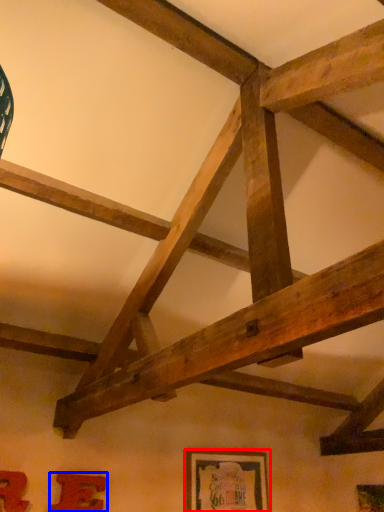
Question: Which of the following is the farthest to the observer, picture frame (highlighted by a red box) or picture frame (highlighted by a blue box)?

Choices:
 (A) picture frame
 (B) picture frame

Answer: (A)